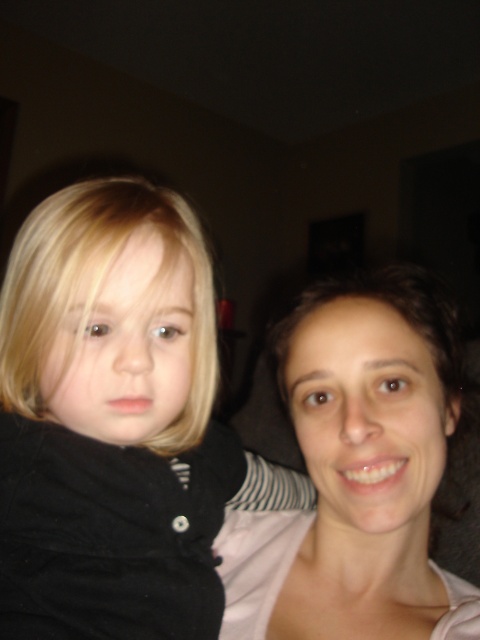
You are a photographer setting up for a family portrait. You have a small camera that can only focus on objects within a 30cm diameter. The black cotton shirt at left and smooth skin face at center are in your viewfinder. Which object will your camera struggle to focus on due to size constraints?

The black cotton shirt at left is bigger than the smooth skin face at center. Since the camera can only focus on objects within a 30cm diameter, the black cotton shirt at left may exceed this size limit and thus be harder to focus on compared to the smaller smooth skin face at center.

You are a photographer setting up for a portrait session. You notice the black cotton shirt at left and the smooth skin face at center. Which object is positioned more to the left in the image?

The black cotton shirt at left is positioned more to the left than the smooth skin face at center.

You are a photographer adjusting the camera settings. The black cotton shirt at left and the smooth skin face at center are both in the frame. Which object is wider in the image?

The black cotton shirt at left is wider than the smooth skin face at center.